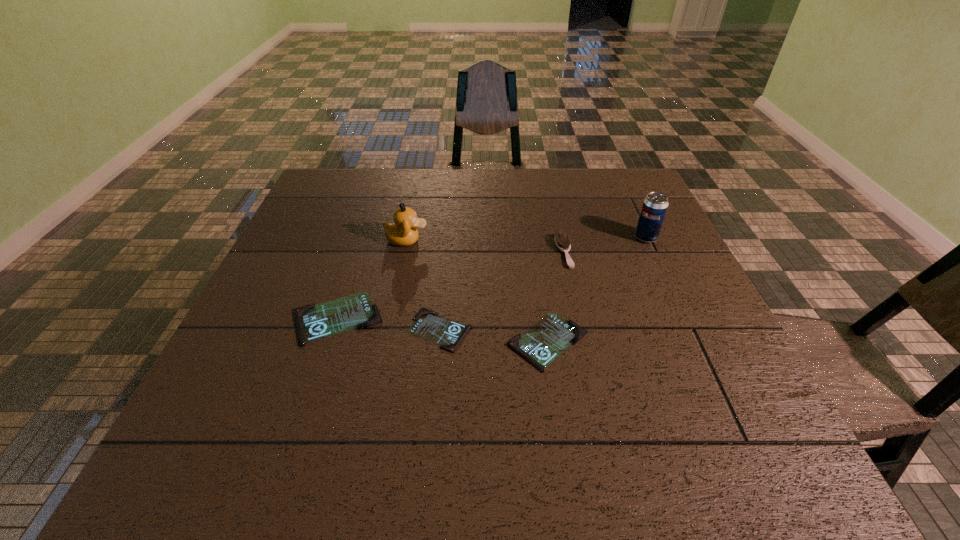
You are a GUI agent. You are given a task and a screenshot of the screen. Output one action in this format:
    pyautogui.click(x=<x>, y=<y>)
    Task: Click on the leftmost identity card
    The height and width of the screenshot is (540, 960).
    Given the screenshot: What is the action you would take?
    pyautogui.click(x=314, y=322)

Find the location of a particular element. This screenshot has width=960, height=540. the second identity card from left to right is located at coordinates (428, 325).

In order to click on the shortest identity card in this screenshot , I will do `click(428, 325)`.

At what (x,y) coordinates should I click in order to perform the action: click on the second shortest identity card. Please return your answer as a coordinate pair (x, y). Looking at the image, I should click on (543, 342).

This screenshot has width=960, height=540. Find the location of `the rightmost identity card`. the rightmost identity card is located at coordinates (543, 342).

This screenshot has width=960, height=540. Identify the location of scrubbing brush. (562, 241).

Find the location of a particular element. The image size is (960, 540). duckling is located at coordinates (403, 232).

The height and width of the screenshot is (540, 960). Identify the location of the rightmost object. (653, 211).

Where is `free space located 0.330m on the right of the leftmost identity card`? free space located 0.330m on the right of the leftmost identity card is located at coordinates (532, 319).

Find the location of a particular element. This screenshot has height=540, width=960. free space located 0.230m on the right of the shortest object is located at coordinates (578, 330).